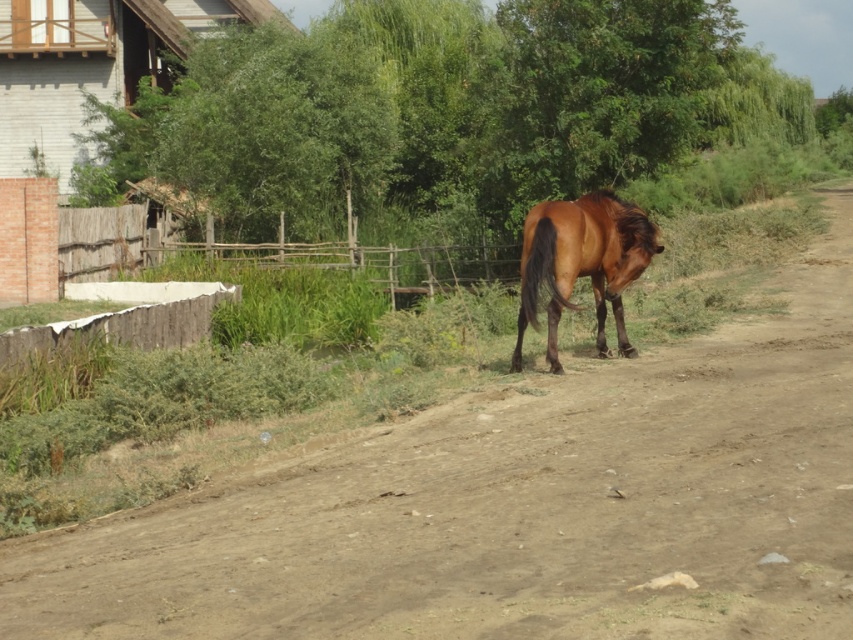
Which of these two, brown dirt track at center or brown glossy horse at center, stands shorter?

brown dirt track at center

Describe the element at coordinates (517, 506) in the screenshot. I see `brown dirt track at center` at that location.

This screenshot has height=640, width=853. I want to click on brown dirt track at center, so click(517, 506).